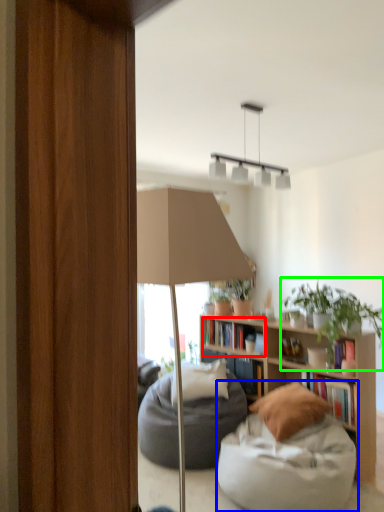
Question: Based on their relative distances, which object is nearer to book (highlighted by a red box)? Choose from chair (highlighted by a blue box) and houseplant (highlighted by a green box).

Choices:
 (A) chair
 (B) houseplant

Answer: (B)